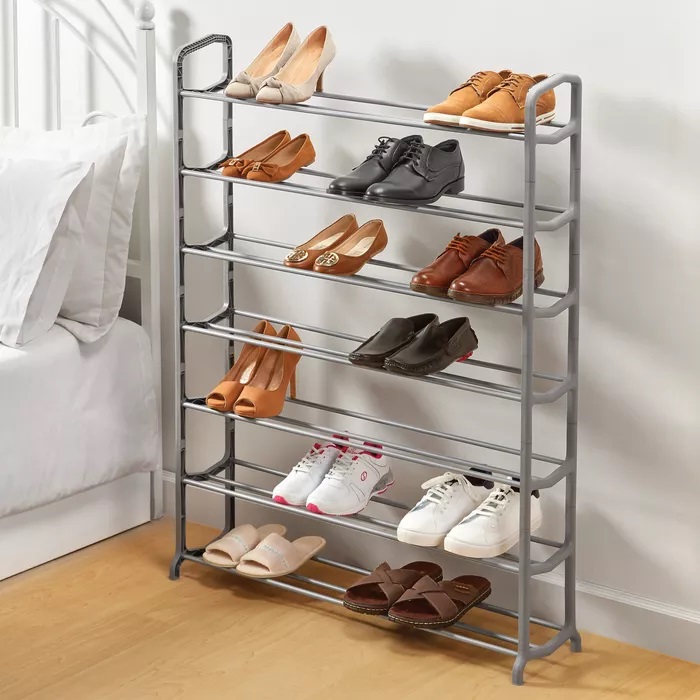
You are a GUI agent. You are given a task and a screenshot of the screen. Output one action in this format:
    pyautogui.click(x=<x>, y=<y>)
    Task: Click on the shoe on top shelf
    Image resolution: width=700 pixels, height=700 pixels.
    Given the screenshot: What is the action you would take?
    pyautogui.click(x=238, y=78), pyautogui.click(x=286, y=88), pyautogui.click(x=441, y=108), pyautogui.click(x=497, y=120)